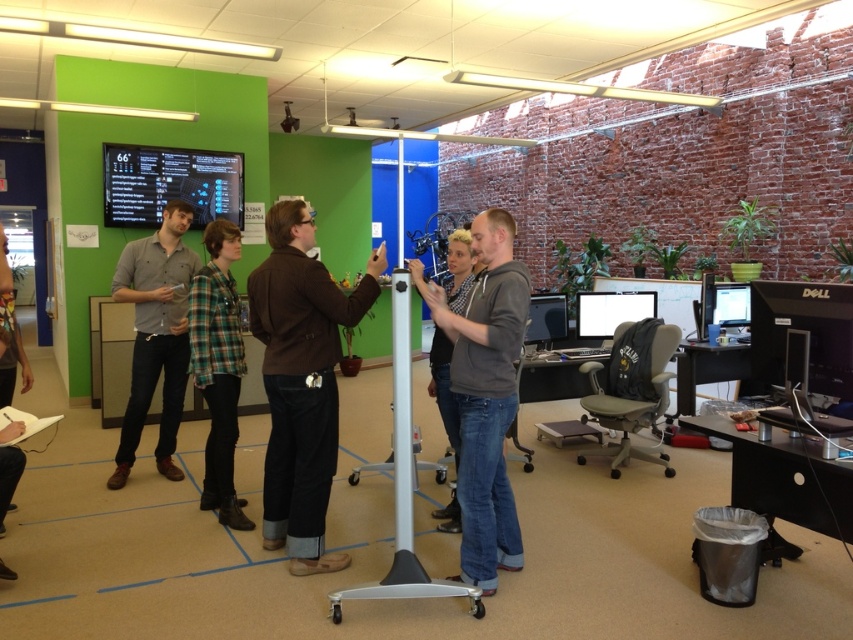
Can you confirm if green plaid shirt at center is shorter than white glossy monitor at center right?

In fact, green plaid shirt at center may be taller than white glossy monitor at center right.

Based on the photo, is green plaid shirt at center taller than white glossy monitor at center right?

Correct, green plaid shirt at center is much taller as white glossy monitor at center right.

Is point (225, 497) in front of point (585, 307)?

Yes, point (225, 497) is closer to viewer.

I want to click on green plaid shirt at center, so click(x=218, y=365).

Which is more to the left, brown leather jacket at center or gray matte hoodie at center?

brown leather jacket at center

Based on the photo, between brown leather jacket at center and gray matte hoodie at center, which one appears on the right side from the viewer's perspective?

Positioned to the right is gray matte hoodie at center.

Describe the element at coordinates (300, 381) in the screenshot. I see `brown leather jacket at center` at that location.

Where is `brown leather jacket at center`? brown leather jacket at center is located at coordinates click(x=300, y=381).

The width and height of the screenshot is (853, 640). I want to click on green plaid shirt at center, so pyautogui.click(x=218, y=365).

Does green plaid shirt at center appear on the right side of matte black monitor at upper left?

Yes, green plaid shirt at center is to the right of matte black monitor at upper left.

Find the location of `green plaid shirt at center`. green plaid shirt at center is located at coordinates (218, 365).